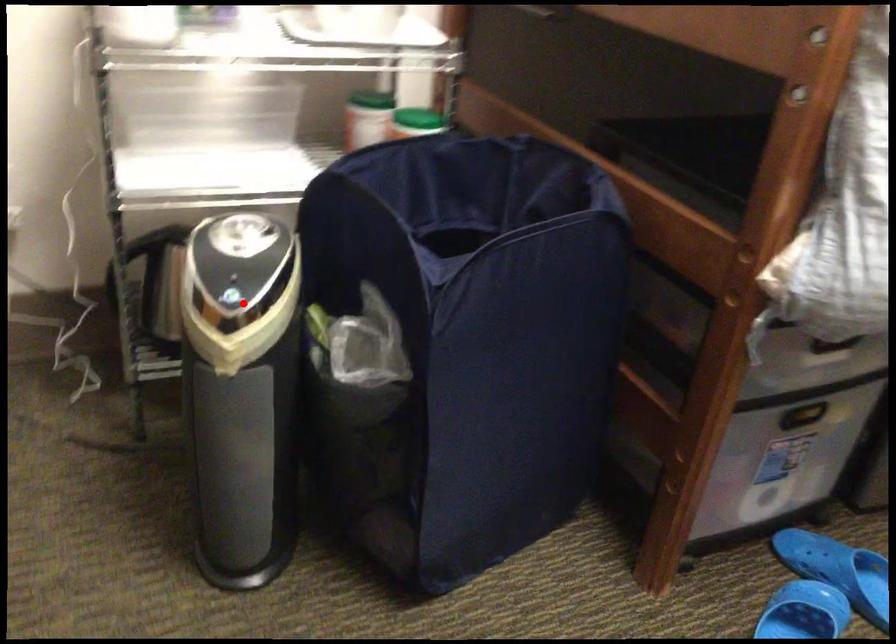
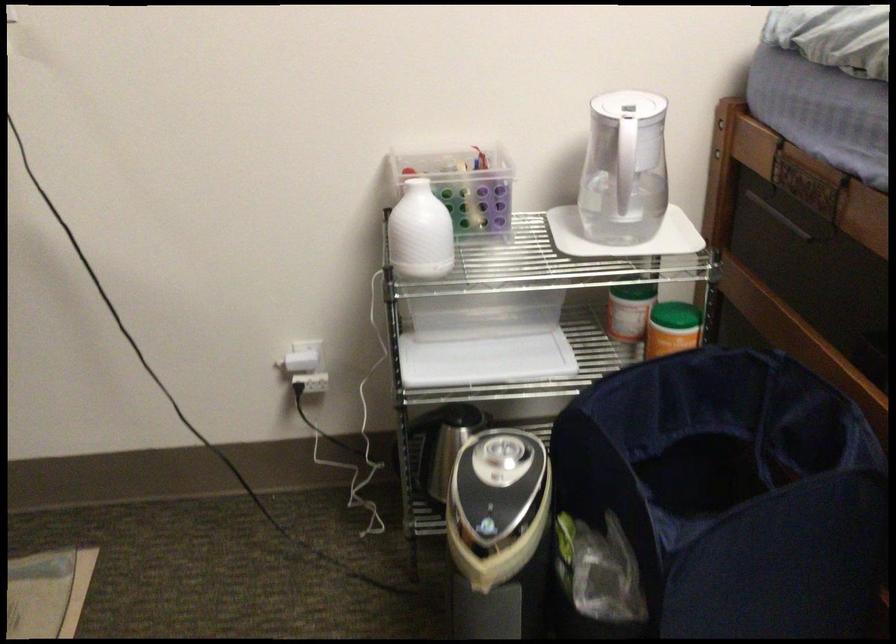
In the second image, find the point that corresponds to the highlighted location in the first image.

(498, 534)